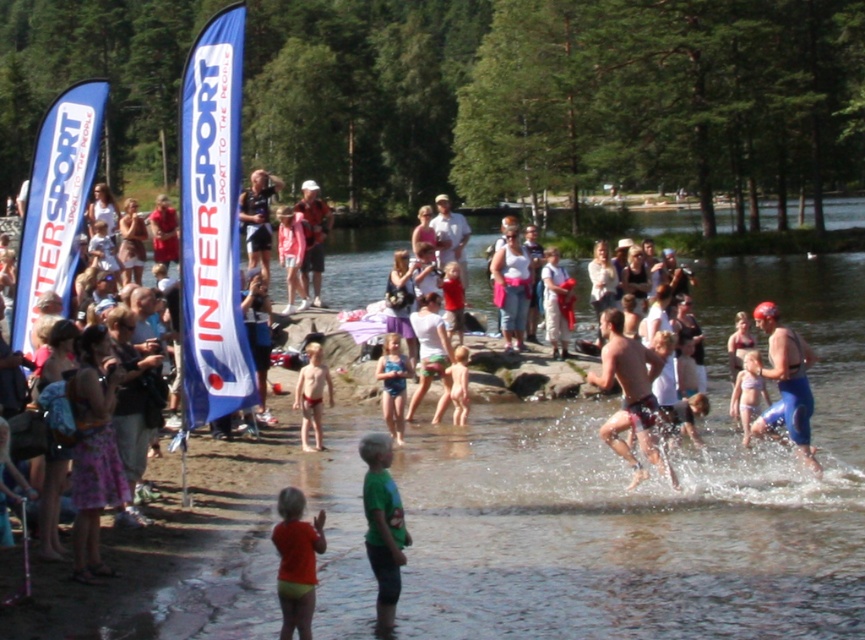
You are organizing a charity swim event and need to ensure participants have enough space. You notice two participants wearing a denim skirt at left and light blue denim shorts at center. Which participant requires more space for their clothing?

The denim skirt at left requires more space because it is bigger than the light blue denim shorts at center.

Consider the image. You are a photographer at the event and want to capture a photo that includes both the blue spandex swim suit at right and the light brown fabric dress at center. Which object should you focus on first to ensure both are in the frame?

The blue spandex swim suit at right is positioned on the right side of the light brown fabric dress at center. To include both in the frame, focus on the light brown fabric dress at center first, then adjust the camera to include the blue spandex swim suit at right on its right side.